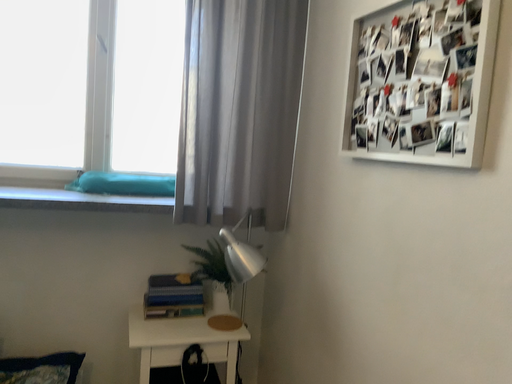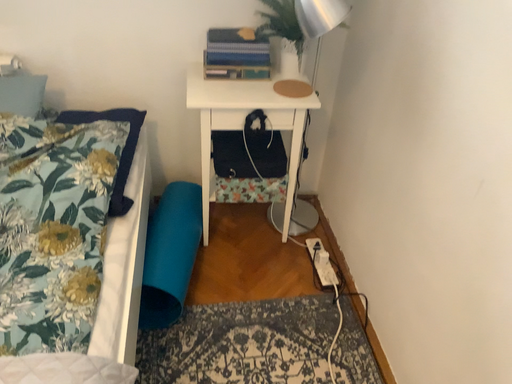
Question: Which way did the camera rotate in the video?

Choices:
 (A) rotated downward
 (B) rotated upward

Answer: (A)